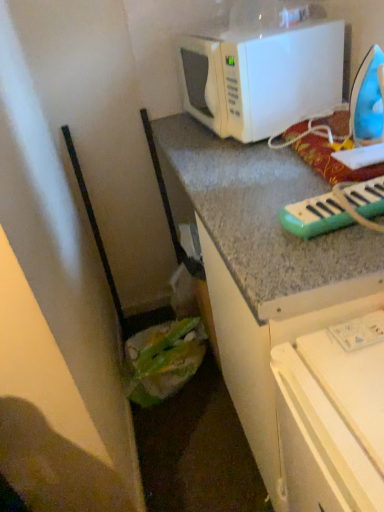
Describe the element at coordinates (367, 100) in the screenshot. Image resolution: width=384 pixels, height=512 pixels. I see `blue plastic iron at upper right` at that location.

Identify the location of blue plastic iron at upper right. This screenshot has height=512, width=384. (367, 100).

Does green plastic musical keyboard at upper right have a smaller size compared to blue plastic iron at upper right?

Yes, green plastic musical keyboard at upper right is smaller than blue plastic iron at upper right.

Between point (315, 228) and point (380, 59), which one is positioned behind?

The point (380, 59) is farther from the camera.

From a real-world perspective, is green plastic musical keyboard at upper right below blue plastic iron at upper right?

Yes, from a real-world perspective, green plastic musical keyboard at upper right is below blue plastic iron at upper right.

From a real-world perspective, is white matte microwave at upper center positioned over green plastic musical keyboard at upper right based on gravity?

Indeed, from a real-world perspective, white matte microwave at upper center stands above green plastic musical keyboard at upper right.

From the picture: Considering the relative positions of white matte microwave at upper center and green plastic musical keyboard at upper right in the image provided, is white matte microwave at upper center to the left of green plastic musical keyboard at upper right from the viewer's perspective?

Indeed, white matte microwave at upper center is positioned on the left side of green plastic musical keyboard at upper right.

Which object is thinner, white matte microwave at upper center or green plastic musical keyboard at upper right?

With smaller width is white matte microwave at upper center.

Which is in front, blue plastic iron at upper right or green plastic musical keyboard at upper right?

green plastic musical keyboard at upper right is more forward.

Is blue plastic iron at upper right at the right side of green plastic musical keyboard at upper right?

Indeed, blue plastic iron at upper right is positioned on the right side of green plastic musical keyboard at upper right.

From the image's perspective, is blue plastic iron at upper right above or below green plastic musical keyboard at upper right?

Based on their image positions, blue plastic iron at upper right is located above green plastic musical keyboard at upper right.

Is blue plastic iron at upper right not within green plastic musical keyboard at upper right?

Indeed, blue plastic iron at upper right is completely outside green plastic musical keyboard at upper right.

Identify the location of musical keyboard on the right of white matte microwave at upper center. (315, 216).

Which object is wider, green plastic musical keyboard at upper right or white matte microwave at upper center?

green plastic musical keyboard at upper right.

How different are the orientations of green plastic musical keyboard at upper right and white matte microwave at upper center in degrees?

There is a 3.77-degree angle between the facing directions of green plastic musical keyboard at upper right and white matte microwave at upper center.

Which is more to the left, green plastic musical keyboard at upper right or white matte microwave at upper center?

white matte microwave at upper center is more to the left.

Is white matte microwave at upper center bigger or smaller than blue plastic iron at upper right?

Clearly, white matte microwave at upper center is larger in size than blue plastic iron at upper right.

Is white matte microwave at upper center positioned beyond the bounds of blue plastic iron at upper right?

white matte microwave at upper center lies outside blue plastic iron at upper right's area.

Considering the sizes of blue plastic iron at upper right and white matte microwave at upper center in the image, is blue plastic iron at upper right taller or shorter than white matte microwave at upper center?

In the image, blue plastic iron at upper right appears to be shorter than white matte microwave at upper center.

How many degrees apart are the facing directions of blue plastic iron at upper right and white matte microwave at upper center?

They differ by 8.67 degrees in their facing directions.

Who is smaller, blue plastic iron at upper right or white matte microwave at upper center?

blue plastic iron at upper right.

The width and height of the screenshot is (384, 512). I want to click on appliance lying above the green plastic musical keyboard at upper right (from the image's perspective), so click(x=367, y=100).

This screenshot has height=512, width=384. Find the location of `musical keyboard in front of the white matte microwave at upper center`. musical keyboard in front of the white matte microwave at upper center is located at coordinates (315, 216).

From the image, which object appears to be nearer to blue plastic iron at upper right, green plastic musical keyboard at upper right or white matte microwave at upper center?

Based on the image, white matte microwave at upper center appears to be nearer to blue plastic iron at upper right.

Estimate the real-world distances between objects in this image. Which object is closer to blue plastic iron at upper right, white matte microwave at upper center or green plastic musical keyboard at upper right?

Based on the image, white matte microwave at upper center appears to be nearer to blue plastic iron at upper right.

Considering their positions, is blue plastic iron at upper right positioned closer to white matte microwave at upper center than green plastic musical keyboard at upper right?

The object closer to white matte microwave at upper center is blue plastic iron at upper right.

When comparing their distances from green plastic musical keyboard at upper right, does blue plastic iron at upper right or white matte microwave at upper center seem closer?

Based on the image, blue plastic iron at upper right appears to be nearer to green plastic musical keyboard at upper right.

Looking at the image, which one is located further to white matte microwave at upper center, green plastic musical keyboard at upper right or blue plastic iron at upper right?

green plastic musical keyboard at upper right.

Consider the image. Looking at the image, which one is located closer to green plastic musical keyboard at upper right, white matte microwave at upper center or blue plastic iron at upper right?

Based on the image, blue plastic iron at upper right appears to be nearer to green plastic musical keyboard at upper right.

Where is `appliance between white matte microwave at upper center and green plastic musical keyboard at upper right vertically`? This screenshot has height=512, width=384. appliance between white matte microwave at upper center and green plastic musical keyboard at upper right vertically is located at coordinates (367, 100).